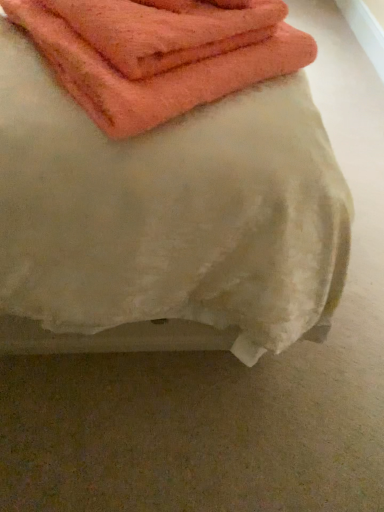
Question: Considering the relative sizes of orange terry cloth towel at upper left, the third towel from the front, and orange cotton towel at upper left, which is the first towel in front-to-back order, in the image provided, is orange terry cloth towel at upper left, the third towel from the front, taller than orange cotton towel at upper left, which is the first towel in front-to-back order,?

Choices:
 (A) no
 (B) yes

Answer: (A)

Question: From the image's perspective, would you say orange terry cloth towel at upper left, the third towel from the front, is shown under orange cotton towel at upper left, the third towel when ordered from back to front?

Choices:
 (A) yes
 (B) no

Answer: (B)

Question: Can you confirm if orange terry cloth towel at upper left, acting as the 1th towel starting from the back, is bigger than orange cotton towel at upper left, which is the first towel in front-to-back order?

Choices:
 (A) yes
 (B) no

Answer: (B)

Question: From a real-world perspective, does orange terry cloth towel at upper left, the third towel from the front, sit lower than orange cotton towel at upper left, which is the first towel in front-to-back order?

Choices:
 (A) no
 (B) yes

Answer: (A)

Question: Considering the relative sizes of orange terry cloth towel at upper left, acting as the 1th towel starting from the back, and orange cotton towel at upper left, which is the first towel in front-to-back order, in the image provided, is orange terry cloth towel at upper left, acting as the 1th towel starting from the back, wider than orange cotton towel at upper left, which is the first towel in front-to-back order,?

Choices:
 (A) yes
 (B) no

Answer: (B)

Question: From the image's perspective, relative to orange cotton towel at upper left, the third towel when ordered from back to front, is orange terry cloth towel at upper left, the 2th towel from the back, above or below?

Choices:
 (A) above
 (B) below

Answer: (A)

Question: Is orange terry cloth towel at upper left, the 2th towel from the back, bigger or smaller than orange cotton towel at upper left, which is the first towel in front-to-back order?

Choices:
 (A) big
 (B) small

Answer: (B)

Question: Considering their positions, is orange terry cloth towel at upper left, marked as the 2th towel in a front-to-back arrangement, located in front of or behind orange cotton towel at upper left, the third towel when ordered from back to front?

Choices:
 (A) behind
 (B) front

Answer: (A)

Question: Is orange terry cloth towel at upper left, the 2th towel from the back, to the left or to the right of orange cotton towel at upper left, which is the first towel in front-to-back order, in the image?

Choices:
 (A) right
 (B) left

Answer: (B)

Question: Does point (96, 170) appear closer or farther from the camera than point (66, 66)?

Choices:
 (A) farther
 (B) closer

Answer: (B)

Question: Is orange cotton towel at upper left, the third towel when ordered from back to front, taller or shorter than orange terry cloth towel at upper left, the 2th towel from the back?

Choices:
 (A) tall
 (B) short

Answer: (A)

Question: From the image's perspective, is orange cotton towel at upper left, which is the first towel in front-to-back order, above or below orange terry cloth towel at upper left, marked as the 2th towel in a front-to-back arrangement?

Choices:
 (A) below
 (B) above

Answer: (A)

Question: Would you say orange cotton towel at upper left, which is the first towel in front-to-back order, is inside or outside orange terry cloth towel at upper left, marked as the 2th towel in a front-to-back arrangement?

Choices:
 (A) outside
 (B) inside

Answer: (A)

Question: Would you say orange terry cloth towel at upper left, the third towel from the front, is to the left or to the right of orange terry cloth towel at upper left, the 2th towel from the back, in the picture?

Choices:
 (A) left
 (B) right

Answer: (B)

Question: Relative to orange terry cloth towel at upper left, the 2th towel from the back, is orange terry cloth towel at upper left, the third towel from the front, in front or behind?

Choices:
 (A) behind
 (B) front

Answer: (A)